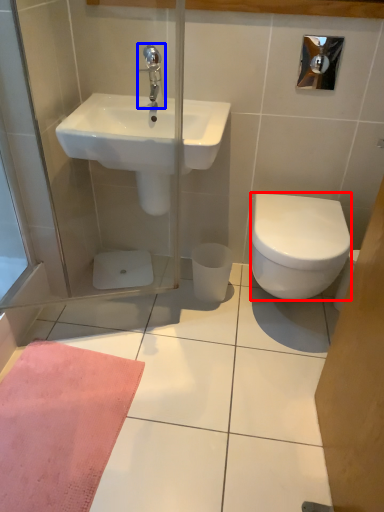
Question: Which of the following is the farthest to the observer, bidet (highlighted by a red box) or tap (highlighted by a blue box)?

Choices:
 (A) bidet
 (B) tap

Answer: (B)